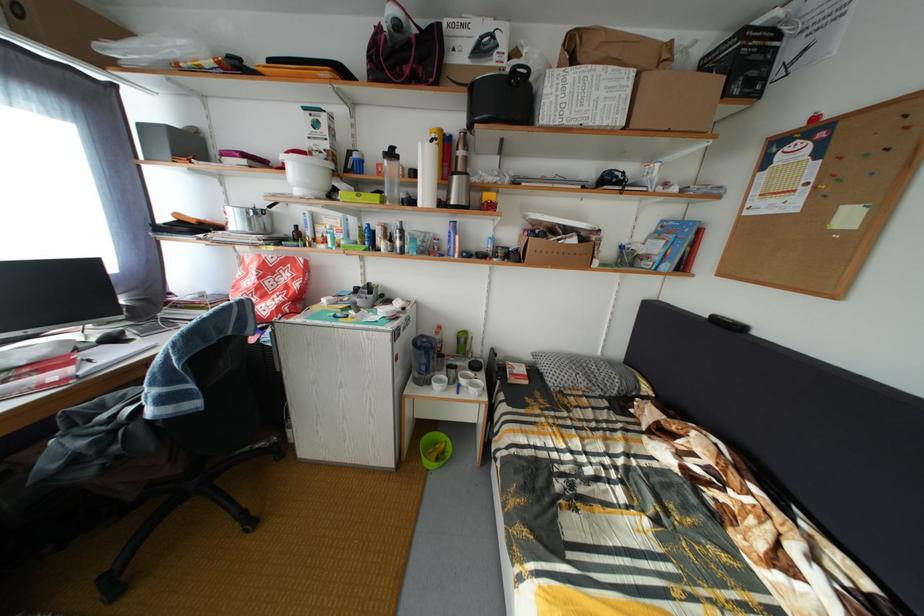
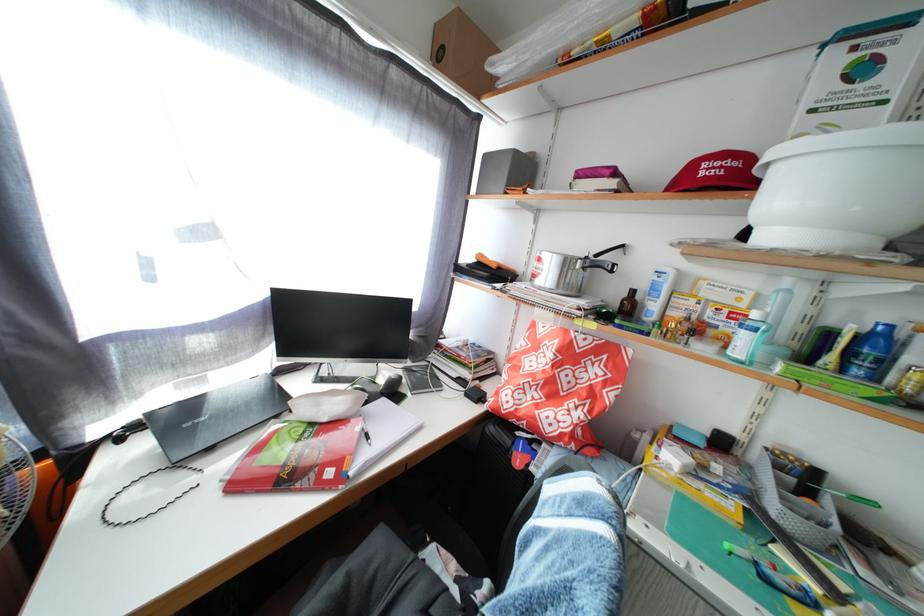
Question: I am providing you with two images of the same scene from different viewpoints. Which of the following objects are not visible in image2?

Choices:
 (A) black pot handle
 (B) clear plastic bottle
 (C) small brown bottle
 (D) none of these

Answer: (D)